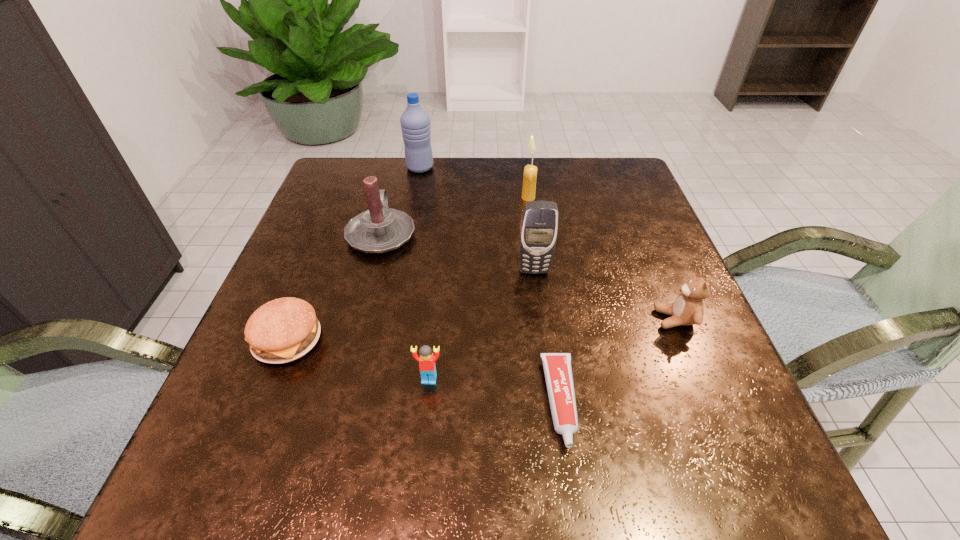
This screenshot has height=540, width=960. I want to click on blank region between the second farthest object and the third farthest object, so click(x=455, y=215).

Where is `unoccupied position between the fifth nearest object and the farthest object`? The width and height of the screenshot is (960, 540). unoccupied position between the fifth nearest object and the farthest object is located at coordinates (477, 219).

This screenshot has height=540, width=960. Identify the location of empty location between the third shortest object and the toothpaste. (494, 390).

Where is `vacant space in between the shortest object and the farthest object`? This screenshot has height=540, width=960. vacant space in between the shortest object and the farthest object is located at coordinates (491, 285).

The height and width of the screenshot is (540, 960). Find the location of `object that is the fourth closest to the Lego`. object that is the fourth closest to the Lego is located at coordinates (380, 229).

Select which object appears as the fifth closest to the right candle. Please provide its 2D coordinates. Your answer should be formatted as a tuple, i.e. [(x, y)], where the tuple contains the x and y coordinates of a point satisfying the conditions above.

[(557, 366)]

Find the location of a particular element. This screenshot has width=960, height=540. vacant space that satisfies the following two spatial constraints: 1. on the front-facing side of the teddy bear; 2. on the face of the fourth object from left to right is located at coordinates (700, 379).